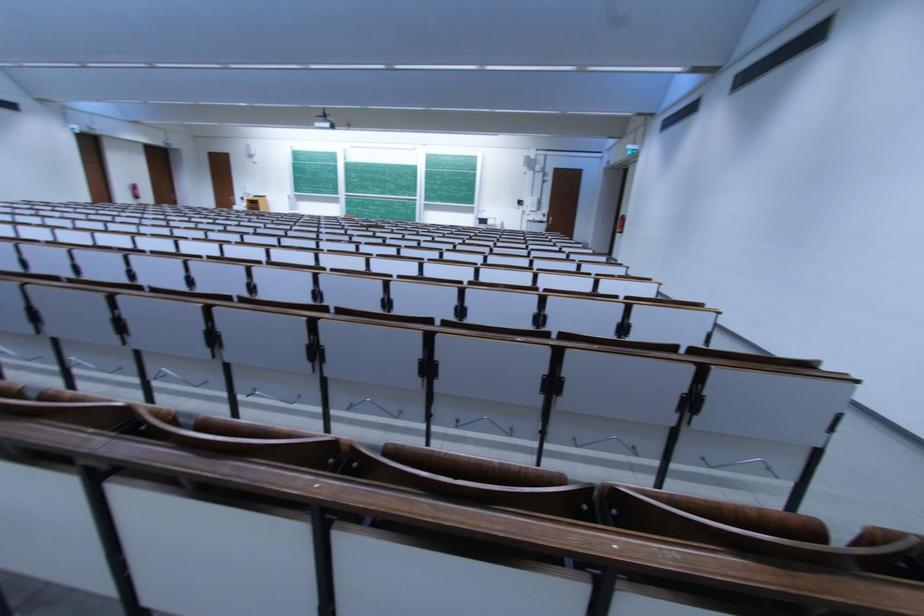
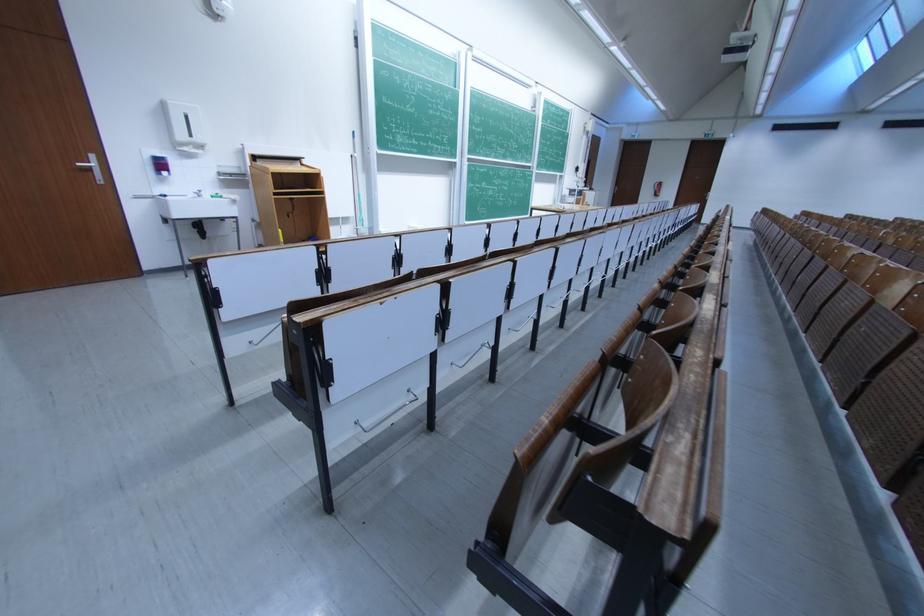
Where in the second image is the point corresponding to the point at 257,195 from the first image?

(205, 142)